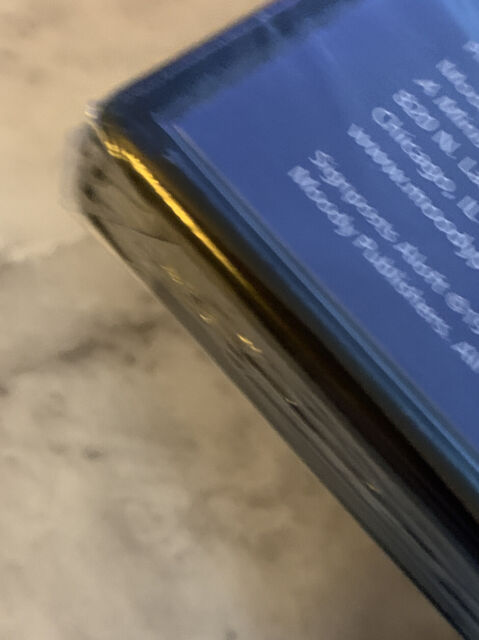
Where is `gold foil trim`? gold foil trim is located at coordinates (162, 192).